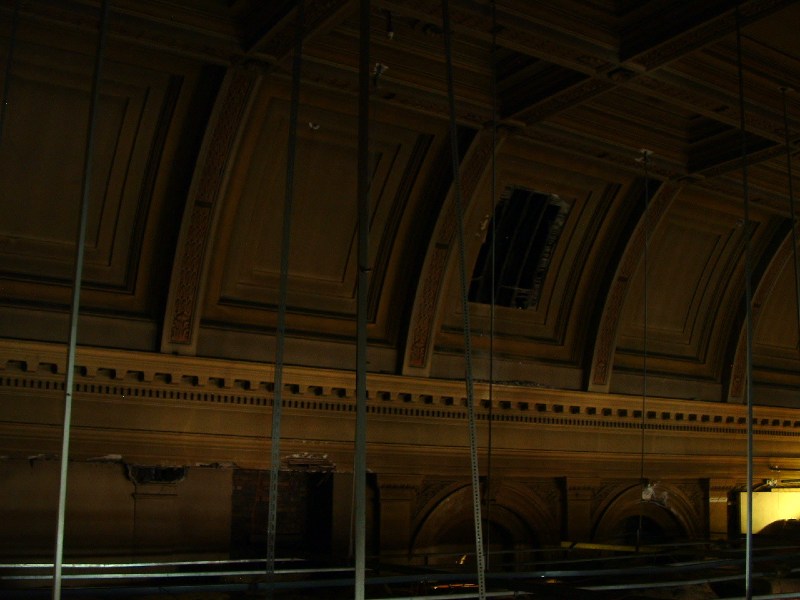
Where is `window with bars on it`? window with bars on it is located at coordinates (526, 253).